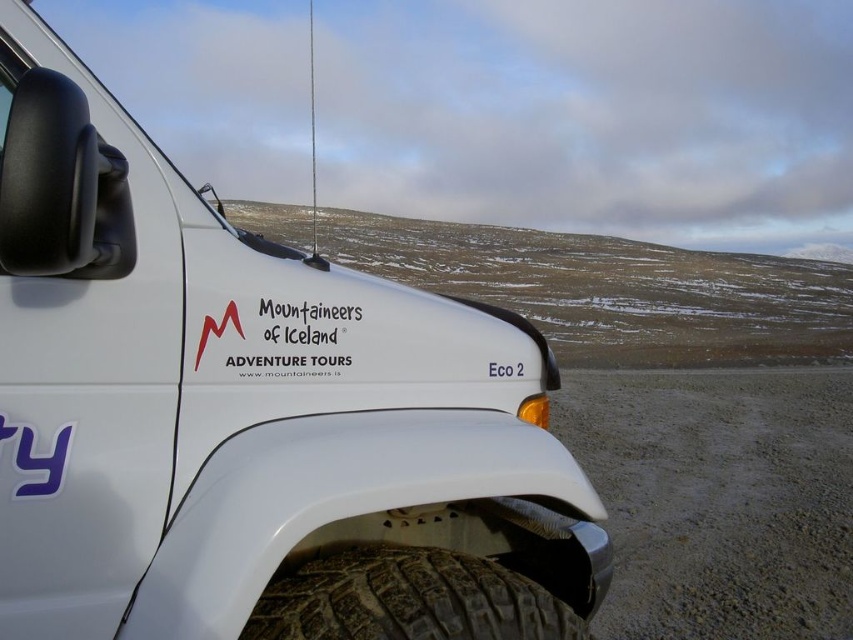
Question: Does white matte vehicle at center have a lesser width compared to gray gravel dirt track at lower right?

Choices:
 (A) yes
 (B) no

Answer: (A)

Question: Which point is closer to the camera taking this photo?

Choices:
 (A) (671, 609)
 (B) (61, 493)

Answer: (B)

Question: Does white matte vehicle at center appear under black rubber tire at lower center?

Choices:
 (A) no
 (B) yes

Answer: (A)

Question: Which of the following is the farthest from the observer?

Choices:
 (A) white matte vehicle at center
 (B) gray gravel dirt track at lower right

Answer: (B)

Question: Among these points, which one is nearest to the camera?

Choices:
 (A) click(102, 173)
 (B) click(611, 506)
 (C) click(502, 609)

Answer: (A)

Question: Is white matte vehicle at center thinner than gray gravel dirt track at lower right?

Choices:
 (A) no
 (B) yes

Answer: (B)